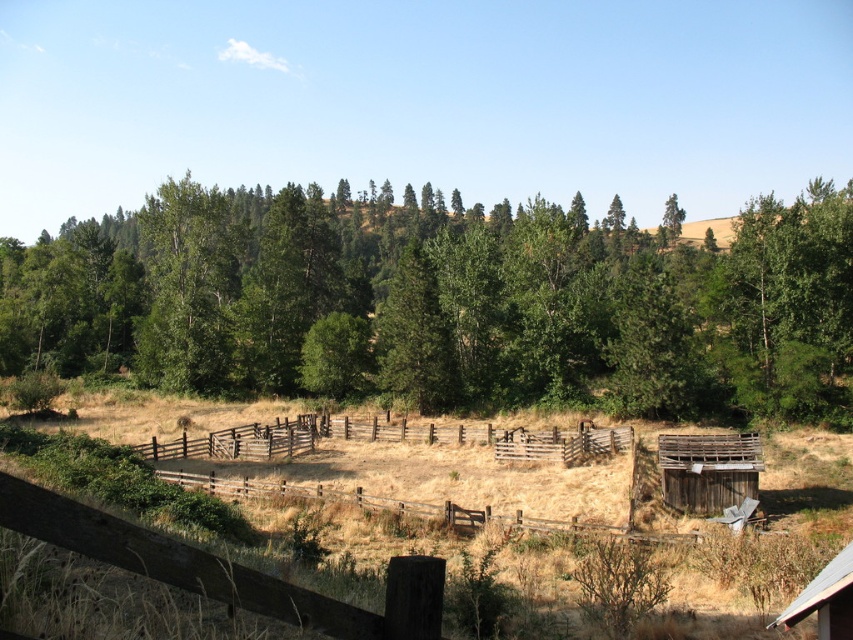
Question: Which object is positioned farthest from the wooden fence at center?

Choices:
 (A) rusty wooden barn at lower right
 (B) green matte tree at center
 (C) metallic silver barn at lower right

Answer: (B)

Question: Which point is closer to the camera?

Choices:
 (A) green matte tree at center
 (B) metallic silver barn at lower right

Answer: (B)

Question: Considering the relative positions of green matte tree at center and metallic silver barn at lower right in the image provided, where is green matte tree at center located with respect to metallic silver barn at lower right?

Choices:
 (A) right
 (B) left

Answer: (B)

Question: Estimate the real-world distances between objects in this image. Which object is closer to the wooden fence at center?

Choices:
 (A) rusty wooden barn at lower right
 (B) green matte tree at center

Answer: (A)

Question: Can you confirm if wooden fence at center is positioned below rusty wooden barn at lower right?

Choices:
 (A) no
 (B) yes

Answer: (A)

Question: Is green matte tree at center smaller than rusty wooden barn at lower right?

Choices:
 (A) no
 (B) yes

Answer: (A)